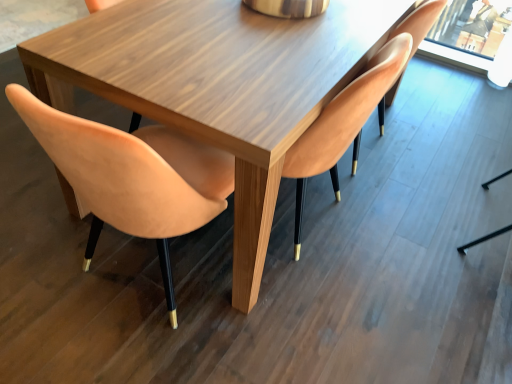
The width and height of the screenshot is (512, 384). What are the coordinates of `suede-like peach chair at left, which ranks as the third chair in right-to-left order` in the screenshot? It's located at (129, 176).

Is matte wood chair at center, which is the 2th chair from right to left, bigger or smaller than suede-like peach chair at left, which ranks as the third chair in right-to-left order?

In the image, matte wood chair at center, which is the 2th chair from right to left, appears to be larger than suede-like peach chair at left, which ranks as the third chair in right-to-left order.

Which point is more forward, (353,160) or (39,110)?

The point (39,110) is closer.

Between matte wood chair at center, the 2th chair positioned from the left, and suede-like peach chair at left, which is counted as the first chair, starting from the left, which one appears on the left side from the viewer's perspective?

suede-like peach chair at left, which is counted as the first chair, starting from the left.

How much distance is there between matte wood chair at center, the 2th chair positioned from the left, and suede-like peach chair at left, which is counted as the first chair, starting from the left?

matte wood chair at center, the 2th chair positioned from the left, is 19.07 inches from suede-like peach chair at left, which is counted as the first chair, starting from the left.

Is suede-like peach chair at left, which ranks as the third chair in right-to-left order, at the right side of matte wood chair at center, which is the 2th chair from right to left?

No.

Does point (93, 206) lie behind point (364, 85)?

No, (93, 206) is closer to viewer.

This screenshot has width=512, height=384. Identify the location of the 1st chair above the suede-like peach chair at left, which ranks as the third chair in right-to-left order (from the image's perspective). (343, 123).

From the picture: Is matte wood chair at center, the 2th chair positioned from the left, thinner than matte orange chair at upper right, arranged as the 1th chair when viewed from the right?

Incorrect, the width of matte wood chair at center, the 2th chair positioned from the left, is not less than that of matte orange chair at upper right, arranged as the 1th chair when viewed from the right.

Can you confirm if matte wood chair at center, which is the 2th chair from right to left, is smaller than matte orange chair at upper right, arranged as the 1th chair when viewed from the right?

Incorrect, matte wood chair at center, which is the 2th chair from right to left, is not smaller in size than matte orange chair at upper right, arranged as the 1th chair when viewed from the right.

Can we say matte wood chair at center, the 2th chair positioned from the left, lies outside matte orange chair at upper right, the 3th chair in the left-to-right sequence?

Yes, matte wood chair at center, the 2th chair positioned from the left, is outside of matte orange chair at upper right, the 3th chair in the left-to-right sequence.

Find the location of a particular element. Image resolution: width=512 pixels, height=384 pixels. the 2nd chair counting from the right of the suede-like peach chair at left, which is counted as the first chair, starting from the left is located at coordinates (419, 22).

Does suede-like peach chair at left, which ranks as the third chair in right-to-left order, appear on the left side of matte orange chair at upper right, the 3th chair in the left-to-right sequence?

Yes, suede-like peach chair at left, which ranks as the third chair in right-to-left order, is to the left of matte orange chair at upper right, the 3th chair in the left-to-right sequence.

Are suede-like peach chair at left, which ranks as the third chair in right-to-left order, and matte orange chair at upper right, arranged as the 1th chair when viewed from the right, making contact?

suede-like peach chair at left, which ranks as the third chair in right-to-left order, and matte orange chair at upper right, arranged as the 1th chair when viewed from the right, are not in contact.

Considering the relative sizes of suede-like peach chair at left, which ranks as the third chair in right-to-left order, and matte orange chair at upper right, arranged as the 1th chair when viewed from the right, in the image provided, is suede-like peach chair at left, which ranks as the third chair in right-to-left order, shorter than matte orange chair at upper right, arranged as the 1th chair when viewed from the right,?

No.

Is matte orange chair at upper right, arranged as the 1th chair when viewed from the right, in contact with suede-like peach chair at left, which is counted as the first chair, starting from the left?

No, matte orange chair at upper right, arranged as the 1th chair when viewed from the right, is not making contact with suede-like peach chair at left, which is counted as the first chair, starting from the left.

Is suede-like peach chair at left, which is counted as the first chair, starting from the left, completely or partially inside matte orange chair at upper right, arranged as the 1th chair when viewed from the right?

Definitely not — suede-like peach chair at left, which is counted as the first chair, starting from the left, is not inside matte orange chair at upper right, arranged as the 1th chair when viewed from the right.

Is matte orange chair at upper right, arranged as the 1th chair when viewed from the right, facing towards suede-like peach chair at left, which ranks as the third chair in right-to-left order?

No, matte orange chair at upper right, arranged as the 1th chair when viewed from the right, is not aimed at suede-like peach chair at left, which ranks as the third chair in right-to-left order.

In the scene shown: Between matte orange chair at upper right, the 3th chair in the left-to-right sequence, and suede-like peach chair at left, which is counted as the first chair, starting from the left, which one is positioned in front?

suede-like peach chair at left, which is counted as the first chair, starting from the left, is in front.

From a real-world perspective, which object rests below the other?

matte orange chair at upper right, the 3th chair in the left-to-right sequence, is physically lower.

Would you say matte orange chair at upper right, arranged as the 1th chair when viewed from the right, is inside or outside matte wood chair at center, the 2th chair positioned from the left?

matte orange chair at upper right, arranged as the 1th chair when viewed from the right, lies outside matte wood chair at center, the 2th chair positioned from the left.

Between matte orange chair at upper right, the 3th chair in the left-to-right sequence, and matte wood chair at center, which is the 2th chair from right to left, which one has more height?

matte wood chair at center, which is the 2th chair from right to left.

Considering the points (420, 24) and (367, 101), which point is behind, point (420, 24) or point (367, 101)?

Point (420, 24)

Find the location of a particular element. chair located in front of the matte wood chair at center, the 2th chair positioned from the left is located at coordinates (129, 176).

From the image's perspective, count 1st chairs upward from the suede-like peach chair at left, which is counted as the first chair, starting from the left, and point to it. Please provide its 2D coordinates.

[(343, 123)]

Based on their spatial positions, is matte orange chair at upper right, the 3th chair in the left-to-right sequence, or matte wood chair at center, the 2th chair positioned from the left, closer to suede-like peach chair at left, which is counted as the first chair, starting from the left?

The object closer to suede-like peach chair at left, which is counted as the first chair, starting from the left, is matte wood chair at center, the 2th chair positioned from the left.

Estimate the real-world distances between objects in this image. Which object is closer to suede-like peach chair at left, which ranks as the third chair in right-to-left order, matte wood chair at center, the 2th chair positioned from the left, or matte orange chair at upper right, arranged as the 1th chair when viewed from the right?

matte wood chair at center, the 2th chair positioned from the left, is closer to suede-like peach chair at left, which ranks as the third chair in right-to-left order.

From the image, which object appears to be farther from matte orange chair at upper right, the 3th chair in the left-to-right sequence, suede-like peach chair at left, which is counted as the first chair, starting from the left, or matte wood chair at center, the 2th chair positioned from the left?

suede-like peach chair at left, which is counted as the first chair, starting from the left, is positioned further to the anchor matte orange chair at upper right, the 3th chair in the left-to-right sequence.

Which object lies nearer to the anchor point matte orange chair at upper right, arranged as the 1th chair when viewed from the right, matte wood chair at center, which is the 2th chair from right to left, or suede-like peach chair at left, which is counted as the first chair, starting from the left?

matte wood chair at center, which is the 2th chair from right to left.

Consider the image. When comparing their distances from matte wood chair at center, the 2th chair positioned from the left, does matte orange chair at upper right, the 3th chair in the left-to-right sequence, or suede-like peach chair at left, which ranks as the third chair in right-to-left order, seem closer?

matte orange chair at upper right, the 3th chair in the left-to-right sequence, lies closer to matte wood chair at center, the 2th chair positioned from the left, than the other object.

Looking at this image, looking at the image, which one is located further to matte wood chair at center, which is the 2th chair from right to left, suede-like peach chair at left, which ranks as the third chair in right-to-left order, or matte orange chair at upper right, the 3th chair in the left-to-right sequence?

Based on the image, suede-like peach chair at left, which ranks as the third chair in right-to-left order, appears to be further to matte wood chair at center, which is the 2th chair from right to left.

The width and height of the screenshot is (512, 384). Identify the location of chair between suede-like peach chair at left, which ranks as the third chair in right-to-left order, and matte orange chair at upper right, arranged as the 1th chair when viewed from the right. (343, 123).